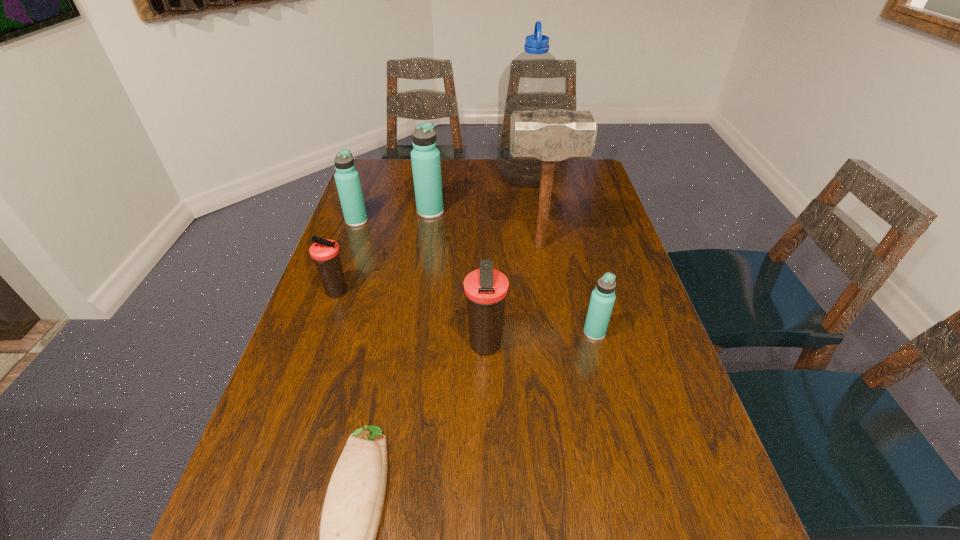
Find the location of a particular element. vacant space at the far right corner is located at coordinates (569, 179).

Locate an element on the screen. empty space that is in between the smaller brown thermos bottle and the nearest aqua thermos bottle is located at coordinates (466, 313).

Locate an element on the screen. The height and width of the screenshot is (540, 960). empty location between the nearest aqua thermos bottle and the mallet is located at coordinates (567, 289).

Locate an element on the screen. The height and width of the screenshot is (540, 960). unoccupied position between the right brown thermos bottle and the third thermos bottle from right to left is located at coordinates (457, 278).

Identify the location of unoccupied area between the tallest thermos bottle and the rightmost thermos bottle. (513, 272).

Where is `free space that is in between the rightmost thermos bottle and the farthest object`? The height and width of the screenshot is (540, 960). free space that is in between the rightmost thermos bottle and the farthest object is located at coordinates (561, 254).

Where is `free space between the farthest object and the right brown thermos bottle`? free space between the farthest object and the right brown thermos bottle is located at coordinates (505, 260).

Find the location of a particular element. This screenshot has height=540, width=960. object that stands as the third closest to the smaller brown thermos bottle is located at coordinates (425, 157).

Where is `object identified as the sixth closest to the nearest aqua thermos bottle`? Image resolution: width=960 pixels, height=540 pixels. object identified as the sixth closest to the nearest aqua thermos bottle is located at coordinates (534, 80).

Select which thermos bottle appears as the second closest to the right brown thermos bottle. Please provide its 2D coordinates. Your answer should be formatted as a tuple, i.e. [(x, y)], where the tuple contains the x and y coordinates of a point satisfying the conditions above.

[(325, 253)]